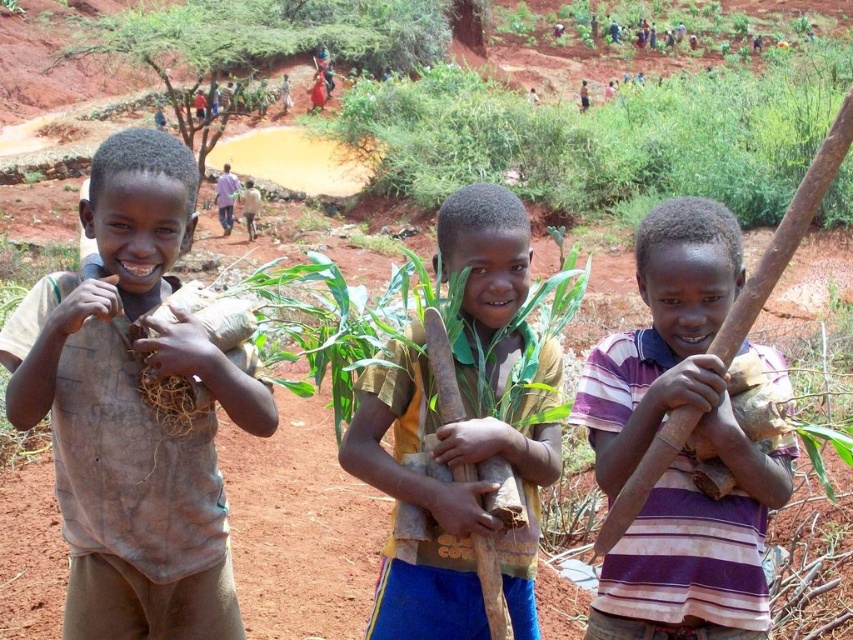
Consider the image. You are a photographer trying to capture a photo of the green leafy plant at upper center and the purple striped shirt at center. Which object should you focus on if you want to include both in the frame without cropping either? Explain your reasoning based on their sizes.

The green leafy plant at upper center has a larger width than the purple striped shirt at center. To include both without cropping, focus on the larger object, the green leafy plant at upper center, as it requires more space in the frame.

In the rural scene, there are three boys standing in the foreground. The boy on the left holds a bundle of dried plant material, the middle boy holds a bundle of green leaves and a wooden stick, and the boy on the right holds a large wooden stick and dried plant material. There is also a green leafy plant represented by the point at coordinates (x=601, y=138). From the perspective of the middle boy, is the green leafy plant at upper center located to his left or right side?

The green leafy plant at upper center is located to the right side of the middle boy.

You are a photographer standing in the scene. You want to take a closeup photo of the brown mud shirt at left. The camera you have can focus on objects within 3 meters. Can you take the photo without moving closer?

The distance of brown mud shirt at left from camera is 3.52 meters, which is beyond the camera focus range of 3 meters. Therefore, you cannot take the photo without moving closer.